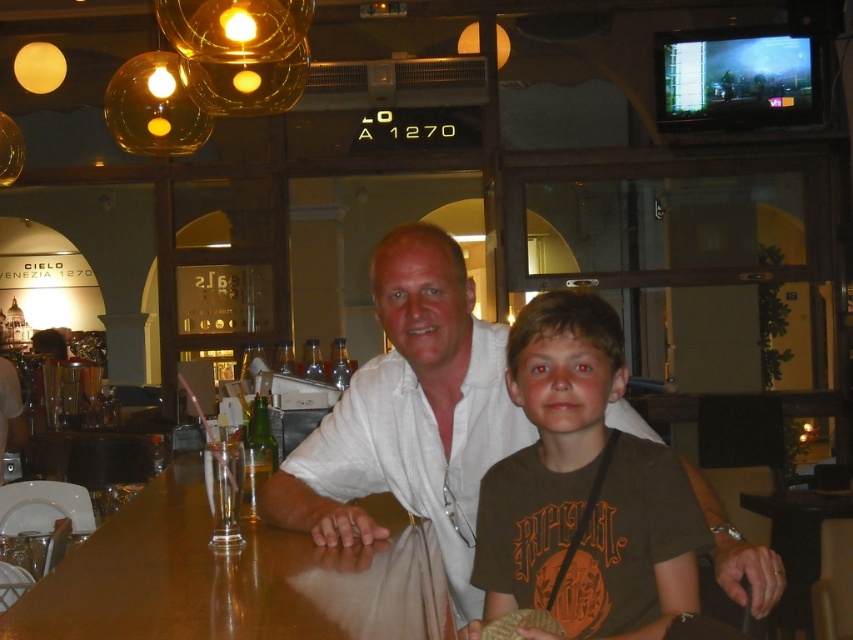
Can you confirm if white cotton shirt at center is positioned below brown cotton t-shirt at center?

Yes, white cotton shirt at center is below brown cotton t-shirt at center.

Is point (384, 285) farther from viewer compared to point (553, 298)?

That is True.

Is point (381, 312) less distant than point (671, 483)?

No, (381, 312) is further to viewer.

At what (x,y) coordinates should I click in order to perform the action: click on white cotton shirt at center. Please return your answer as a coordinate pair (x, y). This screenshot has height=640, width=853. Looking at the image, I should click on tap(410, 416).

Who is positioned more to the right, white cotton shirt at center or shiny brown wood table at center?

white cotton shirt at center

Consider the image. Measure the distance between point (711,499) and camera.

Result: The distance of point (711,499) from camera is 6.32 feet.

You are a GUI agent. You are given a task and a screenshot of the screen. Output one action in this format:
    pyautogui.click(x=<x>, y=<y>)
    Task: Click on the white cotton shirt at center
    The height and width of the screenshot is (640, 853).
    Given the screenshot: What is the action you would take?
    pyautogui.click(x=410, y=416)

Based on the photo, does brown cotton t-shirt at center have a larger size compared to shiny brown wood table at center?

Actually, brown cotton t-shirt at center might be smaller than shiny brown wood table at center.

How distant is brown cotton t-shirt at center from shiny brown wood table at center?

They are 15.25 inches apart.

Describe the element at coordinates (547, 444) in the screenshot. I see `brown cotton t-shirt at center` at that location.

Find the location of a particular element. The height and width of the screenshot is (640, 853). brown cotton t-shirt at center is located at coordinates (547, 444).